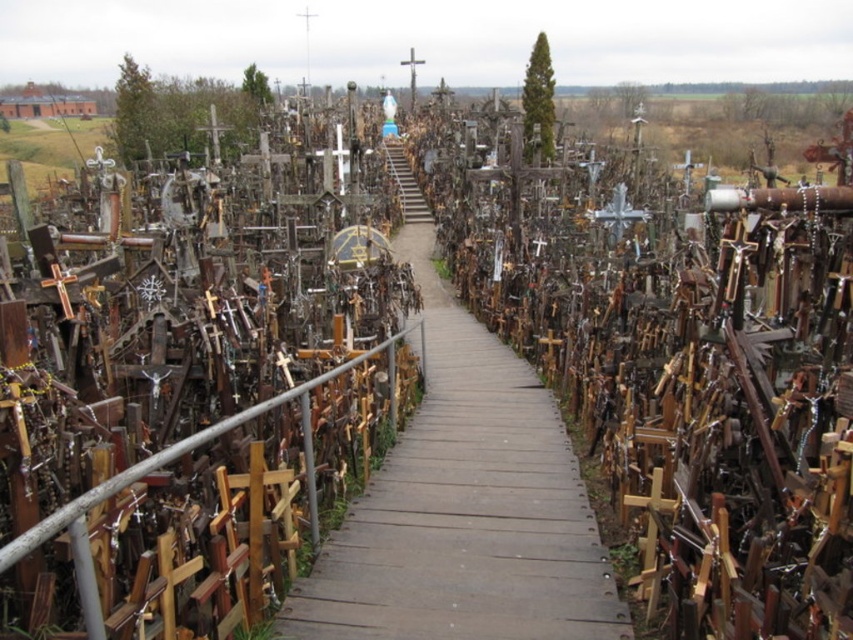
Question: Can you confirm if wooden walkway at center is positioned to the left of metallic cross at left?

Choices:
 (A) no
 (B) yes

Answer: (A)

Question: Is wooden walkway at center to the right of metallic cross at left from the viewer's perspective?

Choices:
 (A) yes
 (B) no

Answer: (A)

Question: Which point is farther from the camera taking this photo?

Choices:
 (A) (55, 262)
 (B) (567, 454)

Answer: (B)

Question: From the image, what is the correct spatial relationship of wooden walkway at center in relation to metallic cross at left?

Choices:
 (A) right
 (B) left

Answer: (A)

Question: Among these points, which one is farthest from the camera?

Choices:
 (A) (442, 353)
 (B) (68, 301)

Answer: (A)

Question: Which of the following is the farthest from the observer?

Choices:
 (A) wooden walkway at center
 (B) metallic cross at left

Answer: (B)